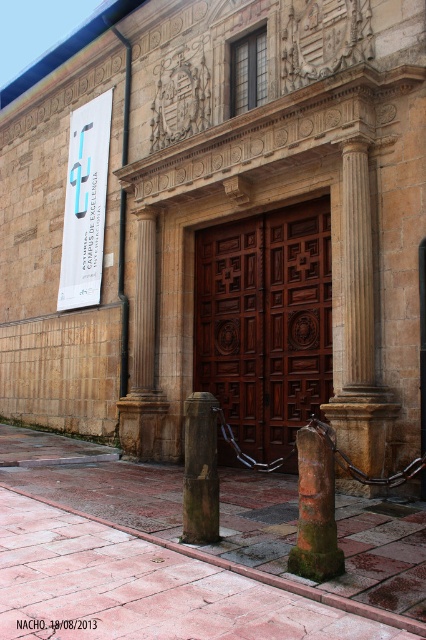
Is stone column at center bigger than rusty stone pillar at lower center?

Yes, stone column at center is bigger than rusty stone pillar at lower center.

Based on the photo, which is more to the right, stone column at center or rusty stone pillar at lower center?

stone column at center

The height and width of the screenshot is (640, 426). In order to click on stone column at center in this screenshot , I will do `click(359, 330)`.

The width and height of the screenshot is (426, 640). Identify the location of stone column at center. (359, 330).

Does wooden at center have a lesser height compared to wooden post at center?

Incorrect, wooden at center's height does not fall short of wooden post at center's.

Where is `wooden at center`? The height and width of the screenshot is (640, 426). wooden at center is located at coordinates (232, 324).

Who is shorter, wooden door at center or wooden at center?

Standing shorter between the two is wooden at center.

Does wooden door at center have a greater width compared to wooden at center?

Yes, wooden door at center is wider than wooden at center.

Is point (279, 253) positioned behind point (259, 458)?

Yes, point (279, 253) is behind point (259, 458).

Where is `wooden door at center`? wooden door at center is located at coordinates (265, 323).